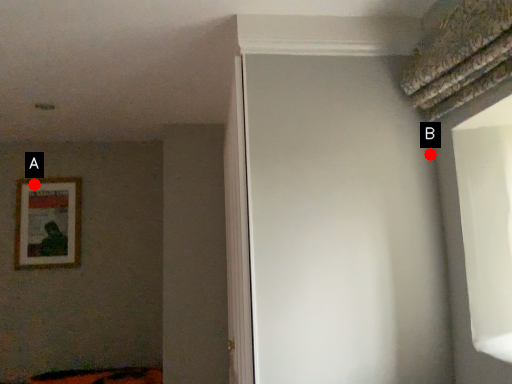
Question: Two points are circled on the image, labeled by A and B beside each circle. Among these points, which one is farthest from the camera?

Choices:
 (A) A is further
 (B) B is further

Answer: (A)